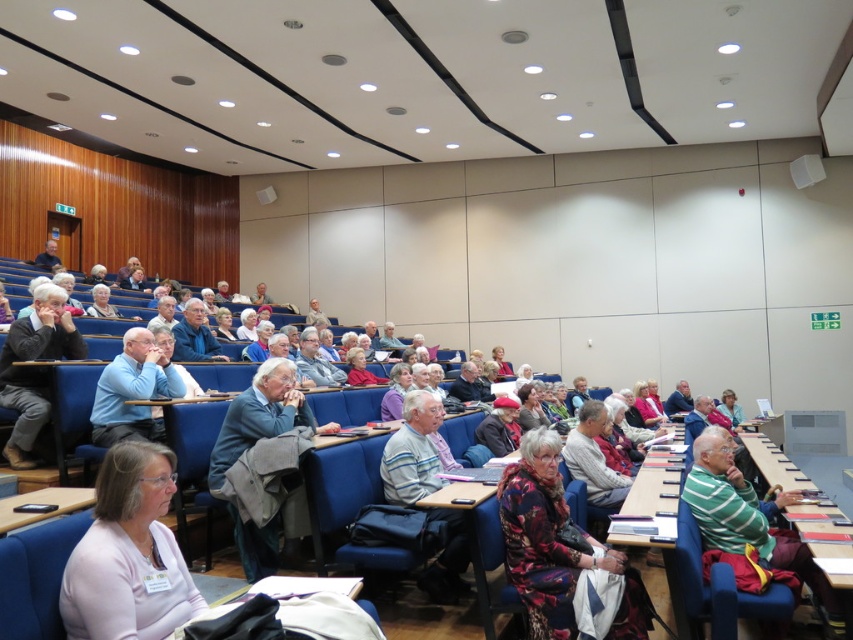
Question: Does gray wool sweater at left have a lesser width compared to light blue shirt at center?

Choices:
 (A) no
 (B) yes

Answer: (B)

Question: Which object appears farthest from the camera in this image?

Choices:
 (A) light blue fabric jacket at center
 (B) pink fabric shirt at lower left
 (C) matte black jacket at center

Answer: (C)

Question: In this image, where is pink fabric shirt at lower left located relative to gray knit sweater at center?

Choices:
 (A) left
 (B) right

Answer: (A)

Question: Which object appears closest to the camera in this image?

Choices:
 (A) light blue shirt at center
 (B) floral fabric dress at center

Answer: (B)

Question: Is gray wool sweater at left wider than light blue shirt at center?

Choices:
 (A) no
 (B) yes

Answer: (A)

Question: Which object is the closest to the floral fabric dress at center?

Choices:
 (A) gray fabric jacket at center
 (B) gray wool sweater at left

Answer: (B)